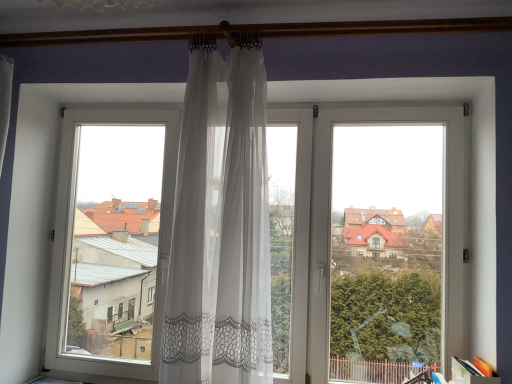
Question: From a real-world perspective, is transparent lace curtain at center below sheer white curtain at center?

Choices:
 (A) no
 (B) yes

Answer: (B)

Question: Considering the relative sizes of transparent lace curtain at center and sheer white curtain at center in the image provided, is transparent lace curtain at center taller than sheer white curtain at center?

Choices:
 (A) no
 (B) yes

Answer: (B)

Question: Is transparent lace curtain at center smaller than sheer white curtain at center?

Choices:
 (A) yes
 (B) no

Answer: (B)

Question: Does transparent lace curtain at center have a lesser width compared to sheer white curtain at center?

Choices:
 (A) no
 (B) yes

Answer: (B)

Question: Does transparent lace curtain at center touch sheer white curtain at center?

Choices:
 (A) no
 (B) yes

Answer: (A)

Question: Does transparent lace curtain at center lie behind sheer white curtain at center?

Choices:
 (A) no
 (B) yes

Answer: (B)

Question: Could you tell me if sheer white curtain at center is turned towards transparent lace curtain at center?

Choices:
 (A) yes
 (B) no

Answer: (B)

Question: Is sheer white curtain at center smaller than transparent lace curtain at center?

Choices:
 (A) no
 (B) yes

Answer: (B)

Question: From a real-world perspective, is sheer white curtain at center located beneath transparent lace curtain at center?

Choices:
 (A) yes
 (B) no

Answer: (B)

Question: Considering the relative positions of sheer white curtain at center and transparent lace curtain at center in the image provided, is sheer white curtain at center to the left of transparent lace curtain at center from the viewer's perspective?

Choices:
 (A) no
 (B) yes

Answer: (B)

Question: Is sheer white curtain at center taller than transparent lace curtain at center?

Choices:
 (A) no
 (B) yes

Answer: (A)

Question: From the image's perspective, is sheer white curtain at center beneath transparent lace curtain at center?

Choices:
 (A) no
 (B) yes

Answer: (A)

Question: Relative to sheer white curtain at center, is transparent lace curtain at center in front or behind?

Choices:
 (A) behind
 (B) front

Answer: (A)